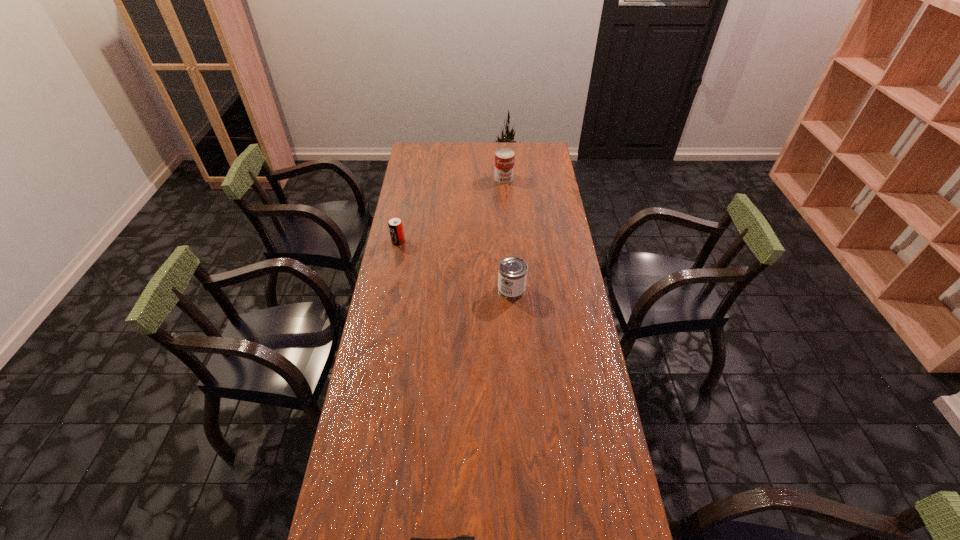
I want to click on the second closest can to the nearest can, so click(x=504, y=158).

You are a GUI agent. You are given a task and a screenshot of the screen. Output one action in this format:
    pyautogui.click(x=<x>, y=<y>)
    Task: Click on the can that is the closest to the flashlight
    This screenshot has width=960, height=540.
    Given the screenshot: What is the action you would take?
    pyautogui.click(x=512, y=274)

The width and height of the screenshot is (960, 540). I want to click on free point that satisfies the following two spatial constraints: 1. on the front label of the farthest can; 2. on the right side of the third farthest object, so click(x=511, y=289).